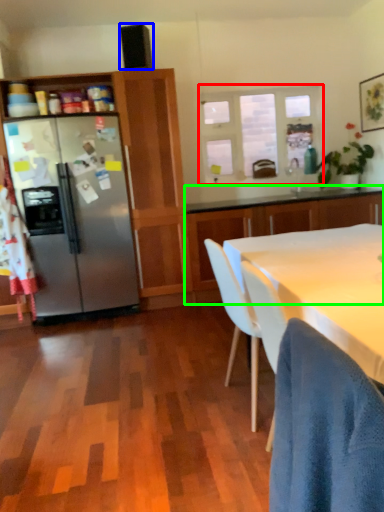
Question: Which object is the farthest from window (highlighted by a red box)? Choose among these: loudspeaker (highlighted by a blue box) or cabinetry (highlighted by a green box).

Choices:
 (A) loudspeaker
 (B) cabinetry

Answer: (A)